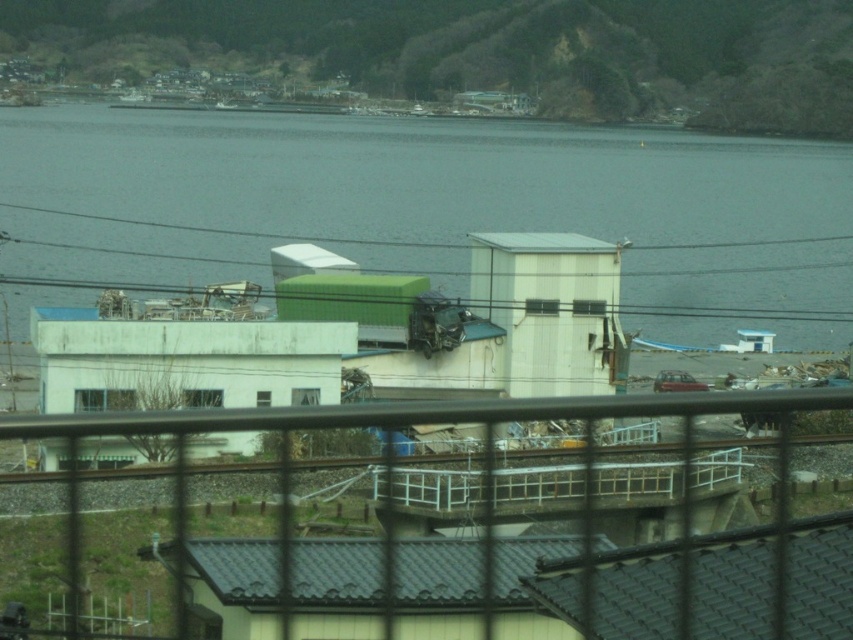
Question: Considering the relative positions of metallic wire fence at center and green matte power line at center in the image provided, where is metallic wire fence at center located with respect to green matte power line at center?

Choices:
 (A) above
 (B) below

Answer: (B)

Question: Is white matte building at center smaller than metallic wire fence at center?

Choices:
 (A) no
 (B) yes

Answer: (A)

Question: In this image, where is white matte building at center located relative to metallic wire fence at center?

Choices:
 (A) above
 (B) below

Answer: (A)

Question: Which object appears closest to the camera in this image?

Choices:
 (A) white matte building at center
 (B) green matte power line at center
 (C) metallic wire fence at center

Answer: (A)

Question: Which object is positioned farthest from the metallic wire fence at center?

Choices:
 (A) green matte power line at center
 (B) white matte building at center

Answer: (A)

Question: Which point is farther to the camera?

Choices:
 (A) (71, 244)
 (B) (584, 568)
 (C) (492, 244)

Answer: (A)